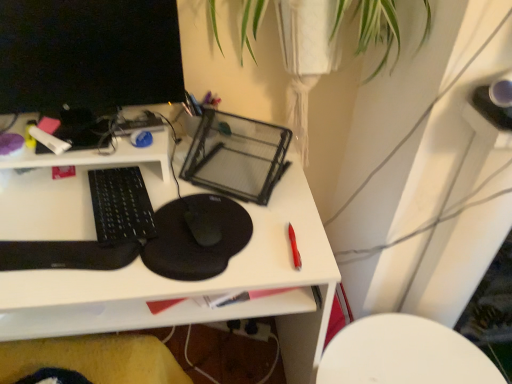
The image size is (512, 384). What are the coordinates of `free point to the left of black matte mousepad at center` in the screenshot? It's located at (57, 239).